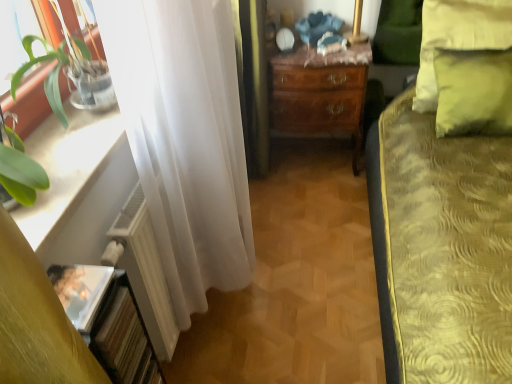
Question: From their relative heights in the image, would you say white sheer curtain at left is taller or shorter than yellow fabric pillow at upper right?

Choices:
 (A) short
 (B) tall

Answer: (B)

Question: Based on their sizes in the image, would you say white sheer curtain at left is bigger or smaller than yellow fabric pillow at upper right?

Choices:
 (A) small
 (B) big

Answer: (B)

Question: Which is nearer to the white sheer curtain at left?

Choices:
 (A) white glossy window sill at left
 (B) mahogany wooden desk at center
 (C) white matte radiator at left
 (D) yellow fabric pillow at upper right
 (E) green leafy plant at left

Answer: (C)

Question: Which object is the farthest from the yellow fabric pillow at upper right?

Choices:
 (A) green leafy plant at left
 (B) white sheer curtain at left
 (C) mahogany wooden desk at center
 (D) white matte radiator at left
 (E) white glossy window sill at left

Answer: (E)